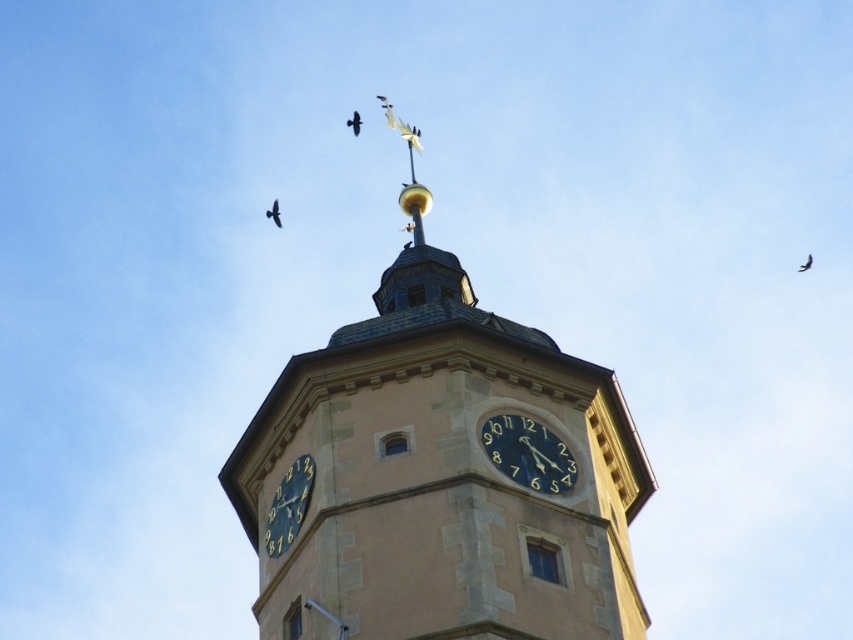
Question: Which object is positioned farthest from the beige stone clock tower at center?

Choices:
 (A) matte black bird at upper center
 (B) dark brown feathered bird at upper center
 (C) black feathered bird at upper right
 (D) brown feathered bird at upper left

Answer: (C)

Question: Can you confirm if dark blue clock face at lower left is wider than brown feathered bird at upper left?

Choices:
 (A) no
 (B) yes

Answer: (A)

Question: Based on their relative distances, which object is nearer to the black feathered bird at upper right?

Choices:
 (A) dark brown feathered bird at upper center
 (B) black glossy clock at center
 (C) dark blue clock face at lower left
 (D) beige stone clock tower at center

Answer: (A)

Question: Can you confirm if dark brown feathered bird at upper center is positioned below matte black bird at upper center?

Choices:
 (A) no
 (B) yes

Answer: (B)

Question: Does beige stone clock tower at center appear over black feathered bird at upper right?

Choices:
 (A) yes
 (B) no

Answer: (A)

Question: Based on their relative distances, which object is farther from the dark blue clock face at lower left?

Choices:
 (A) beige stone clock tower at center
 (B) brown feathered bird at upper left

Answer: (B)